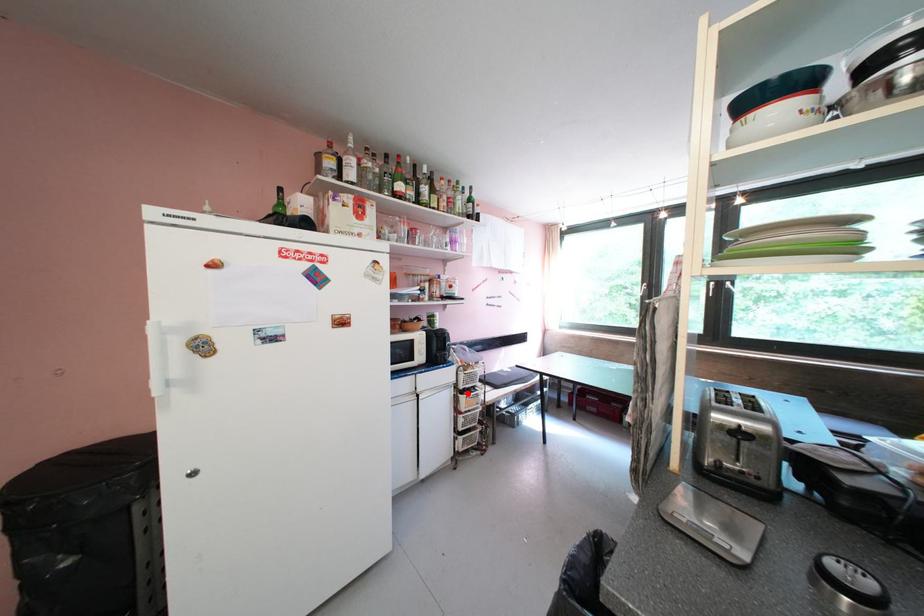
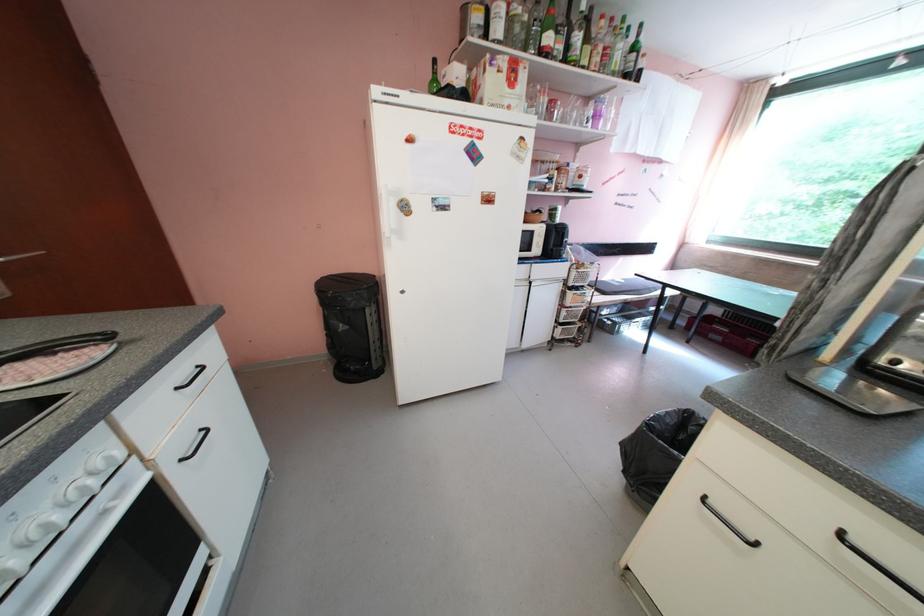
Find the pixel in the second image that matches the highlighted location in the first image.

(576, 290)